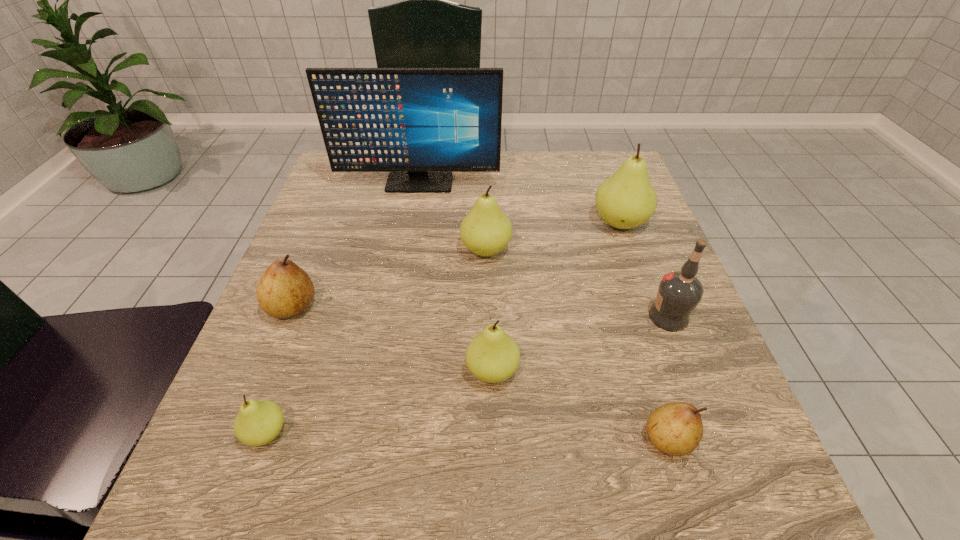
I want to click on computer monitor, so click(419, 124).

Find the location of a particular element. This screenshot has width=960, height=540. the farthest object is located at coordinates (419, 124).

You are a GUI agent. You are given a task and a screenshot of the screen. Output one action in this format:
    pyautogui.click(x=<x>, y=<y>)
    Task: Click on the tallest pear
    The image size is (960, 540).
    Given the screenshot: What is the action you would take?
    pyautogui.click(x=626, y=200)

Locate an element on the screen. The width and height of the screenshot is (960, 540). the biggest green pear is located at coordinates (626, 200).

The image size is (960, 540). What are the coordinates of `vodka` in the screenshot? It's located at (679, 292).

The height and width of the screenshot is (540, 960). I want to click on the second tallest pear, so click(485, 231).

I want to click on the farther brown pear, so click(x=285, y=290).

The width and height of the screenshot is (960, 540). In order to click on the third farthest pear in this screenshot , I will do `click(285, 290)`.

You are a GUI agent. You are given a task and a screenshot of the screen. Output one action in this format:
    pyautogui.click(x=<x>, y=<y>)
    Task: Click on the third nearest pear
    
    Given the screenshot: What is the action you would take?
    pyautogui.click(x=493, y=356)

Identify the location of the third biggest green pear. (493, 356).